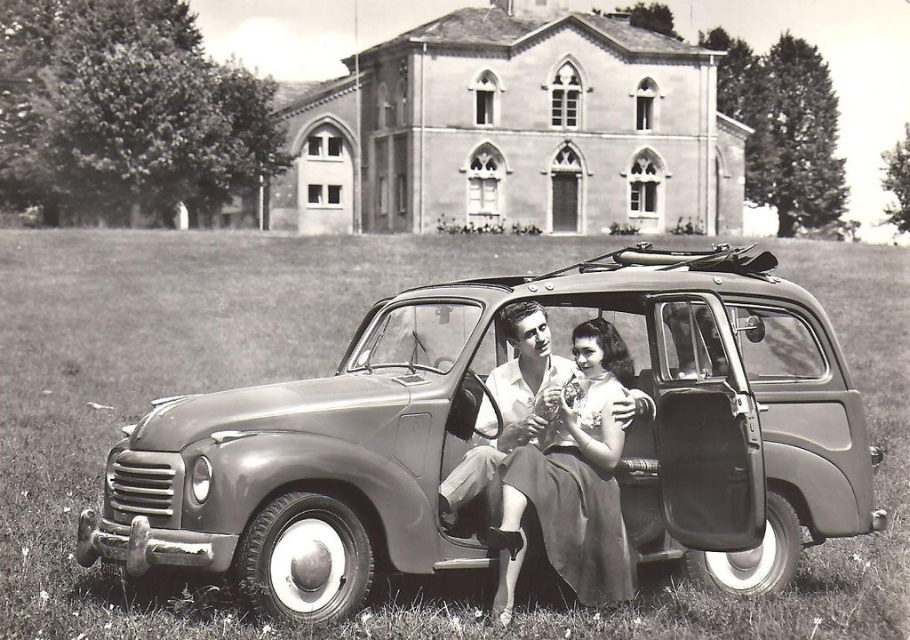
Question: Is metallic gray car at center smaller than smooth fabric dress at center?

Choices:
 (A) no
 (B) yes

Answer: (A)

Question: Which of the following is the closest to the observer?

Choices:
 (A) smooth fabric dress at center
 (B) metallic gray car at center

Answer: (B)

Question: Is metallic gray car at center positioned before smooth fabric dress at center?

Choices:
 (A) no
 (B) yes

Answer: (B)

Question: Does metallic gray car at center have a greater width compared to smooth fabric dress at center?

Choices:
 (A) no
 (B) yes

Answer: (B)

Question: Which point is farther from the camera taking this photo?

Choices:
 (A) (582, 387)
 (B) (521, 353)

Answer: (B)